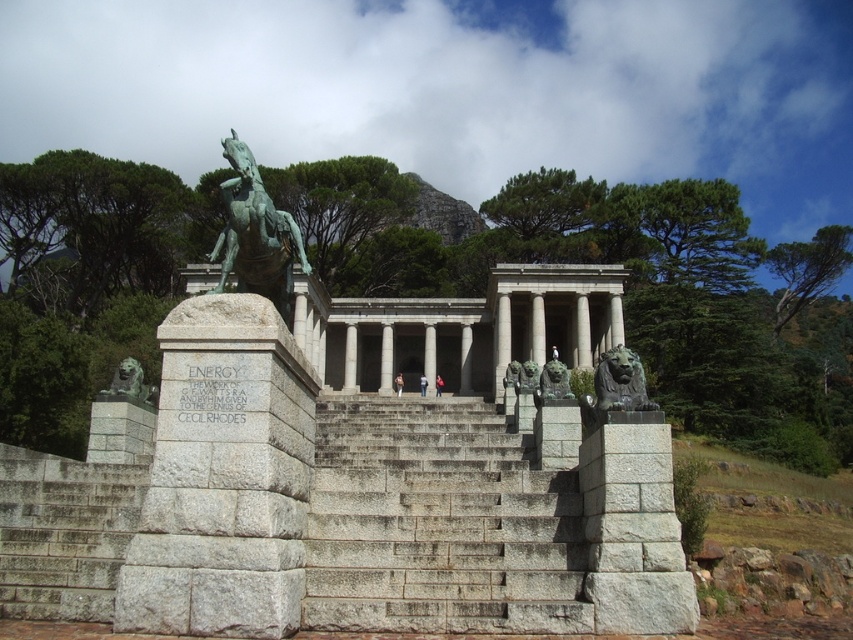
Does gray stone pillar at center appear under slate gray stone lion at lower left?

No.

How far apart are gray stone pillar at center and slate gray stone lion at lower left?

21.53 meters

Identify the location of gray stone pillar at center. The height and width of the screenshot is (640, 853). (224, 477).

Can you confirm if green patina metal horse at upper center is wider than bronze/statue at right?

Indeed, green patina metal horse at upper center has a greater width compared to bronze/statue at right.

Is green patina metal horse at upper center taller than bronze/statue at right?

Indeed, green patina metal horse at upper center has a greater height compared to bronze/statue at right.

Between point (229, 150) and point (606, 369), which one is positioned behind?

The point (229, 150) is more distant.

This screenshot has height=640, width=853. Identify the location of green patina metal horse at upper center. (254, 234).

Can you confirm if gray stone pillar at center is thinner than green patina metal horse at upper center?

Correct, gray stone pillar at center's width is less than green patina metal horse at upper center's.

Who is more distant from viewer, (253, 444) or (242, 266)?

The point (242, 266) is more distant.

This screenshot has width=853, height=640. In order to click on gray stone pillar at center in this screenshot , I will do `click(224, 477)`.